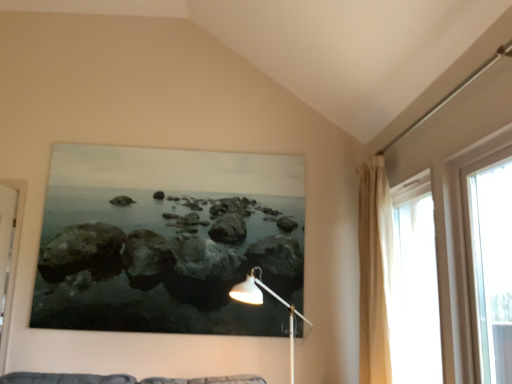
Measure the distance between point (x=380, y=247) and camera.

The distance of point (x=380, y=247) from camera is 2.73 meters.

What do you see at coordinates (262, 303) in the screenshot? The height and width of the screenshot is (384, 512). I see `white metal floor lamp at lower center` at bounding box center [262, 303].

This screenshot has height=384, width=512. What are the coordinates of `beige fabric curtain at right` in the screenshot? It's located at (375, 272).

From a real-world perspective, which is physically below, transparent glass window at right, which is the first window in front-to-back order, or translucent fabric curtain at right, the 2th window when ordered from front to back?

In real-world perspective, translucent fabric curtain at right, the 2th window when ordered from front to back, is lower.

Which point is more distant from viewer, (487, 156) or (407, 226)?

Positioned behind is point (407, 226).

Is transparent glass window at right, acting as the second window starting from the back, shorter than translucent fabric curtain at right, the 2th window when ordered from front to back?

Yes.

Do you think transparent glass window at right, which is the first window in front-to-back order, is within translucent fabric curtain at right, the 2th window when ordered from front to back, or outside of it?

transparent glass window at right, which is the first window in front-to-back order, exists outside the volume of translucent fabric curtain at right, the 2th window when ordered from front to back.

Is translucent fabric curtain at right, the first window in the back-to-front sequence, placed right next to transparent glass window at right, which is the first window in front-to-back order?

No, translucent fabric curtain at right, the first window in the back-to-front sequence, is not making contact with transparent glass window at right, which is the first window in front-to-back order.

Is transparent glass window at right, which is the first window in front-to-back order, a part of translucent fabric curtain at right, the 2th window when ordered from front to back?

No, transparent glass window at right, which is the first window in front-to-back order, is not a part of translucent fabric curtain at right, the 2th window when ordered from front to back.

In order to click on window lying on the right of translucent fabric curtain at right, the 2th window when ordered from front to back in this screenshot , I will do `click(458, 252)`.

Which point is more forward, (x=416, y=272) or (x=442, y=265)?

The point (x=442, y=265) is closer to the camera.

Is beige fabric curtain at right at the right side of translucent fabric curtain at right, the first window in the back-to-front sequence?

In fact, beige fabric curtain at right is to the left of translucent fabric curtain at right, the first window in the back-to-front sequence.

Does beige fabric curtain at right turn towards translucent fabric curtain at right, the 2th window when ordered from front to back?

No, beige fabric curtain at right is not oriented towards translucent fabric curtain at right, the 2th window when ordered from front to back.

From their relative heights in the image, would you say beige fabric curtain at right is taller or shorter than translucent fabric curtain at right, the 2th window when ordered from front to back?

In the image, beige fabric curtain at right appears to be taller than translucent fabric curtain at right, the 2th window when ordered from front to back.

Considering the relative sizes of beige fabric curtain at right and translucent fabric curtain at right, the 2th window when ordered from front to back, in the image provided, is beige fabric curtain at right thinner than translucent fabric curtain at right, the 2th window when ordered from front to back,?

In fact, beige fabric curtain at right might be wider than translucent fabric curtain at right, the 2th window when ordered from front to back.

Would you say translucent fabric curtain at right, the 2th window when ordered from front to back, is part of white metal floor lamp at lower center's contents?

No, translucent fabric curtain at right, the 2th window when ordered from front to back, is not surrounded by white metal floor lamp at lower center.

From a real-world perspective, is white metal floor lamp at lower center positioned under translucent fabric curtain at right, the first window in the back-to-front sequence, based on gravity?

Yes, from a real-world perspective, white metal floor lamp at lower center is beneath translucent fabric curtain at right, the first window in the back-to-front sequence.

Does point (291, 374) lie behind point (413, 381)?

Yes.

Is beige fabric curtain at right turned away from transparent glass window at right, which is the first window in front-to-back order?

No.

Considering the sizes of objects beige fabric curtain at right and transparent glass window at right, acting as the second window starting from the back, in the image provided, who is taller, beige fabric curtain at right or transparent glass window at right, acting as the second window starting from the back,?

Standing taller between the two is beige fabric curtain at right.

Considering the points (481, 144) and (292, 367), which point is in front, point (481, 144) or point (292, 367)?

Positioned in front is point (481, 144).

Considering the sizes of objects transparent glass window at right, which is the first window in front-to-back order, and white metal floor lamp at lower center in the image provided, who is wider, transparent glass window at right, which is the first window in front-to-back order, or white metal floor lamp at lower center?

white metal floor lamp at lower center is wider.

Which object is closer to the camera, transparent glass window at right, which is the first window in front-to-back order, or white metal floor lamp at lower center?

transparent glass window at right, which is the first window in front-to-back order, is closer to the camera.

Is white metal floor lamp at lower center inside or outside of beige fabric curtain at right?

white metal floor lamp at lower center is located beyond the bounds of beige fabric curtain at right.

How many degrees apart are the facing directions of white metal floor lamp at lower center and beige fabric curtain at right?

They differ by 42.6 degrees in their facing directions.

Is white metal floor lamp at lower center with beige fabric curtain at right?

There is a gap between white metal floor lamp at lower center and beige fabric curtain at right.

Does point (286, 303) come behind point (381, 324)?

Yes, point (286, 303) is behind point (381, 324).

The image size is (512, 384). I want to click on window that is under the transparent glass window at right, which is the first window in front-to-back order (from a real-world perspective), so click(x=416, y=283).

The width and height of the screenshot is (512, 384). I want to click on window below the transparent glass window at right, which is the first window in front-to-back order (from the image's perspective), so click(x=416, y=283).

Considering their positions, is transparent glass window at right, acting as the second window starting from the back, positioned closer to white metal floor lamp at lower center than beige fabric curtain at right?

beige fabric curtain at right.

When comparing their distances from beige fabric curtain at right, does transparent glass window at right, acting as the second window starting from the back, or white metal floor lamp at lower center seem closer?

transparent glass window at right, acting as the second window starting from the back, lies closer to beige fabric curtain at right than the other object.

When comparing their distances from white metal floor lamp at lower center, does beige fabric curtain at right or transparent glass window at right, acting as the second window starting from the back, seem further?

transparent glass window at right, acting as the second window starting from the back, is positioned further to the anchor white metal floor lamp at lower center.

When comparing their distances from translucent fabric curtain at right, the first window in the back-to-front sequence, does transparent glass window at right, acting as the second window starting from the back, or beige fabric curtain at right seem closer?

Based on the image, beige fabric curtain at right appears to be nearer to translucent fabric curtain at right, the first window in the back-to-front sequence.

Considering their positions, is translucent fabric curtain at right, the 2th window when ordered from front to back, positioned further to transparent glass window at right, acting as the second window starting from the back, than white metal floor lamp at lower center?

Among the two, white metal floor lamp at lower center is located further to transparent glass window at right, acting as the second window starting from the back.

Based on their spatial positions, is white metal floor lamp at lower center or transparent glass window at right, which is the first window in front-to-back order, closer to translucent fabric curtain at right, the first window in the back-to-front sequence?

transparent glass window at right, which is the first window in front-to-back order.

From the image, which object appears to be nearer to translucent fabric curtain at right, the 2th window when ordered from front to back, white metal floor lamp at lower center or beige fabric curtain at right?

Based on the image, beige fabric curtain at right appears to be nearer to translucent fabric curtain at right, the 2th window when ordered from front to back.

Which object lies nearer to the anchor point beige fabric curtain at right, translucent fabric curtain at right, the 2th window when ordered from front to back, or transparent glass window at right, which is the first window in front-to-back order?

translucent fabric curtain at right, the 2th window when ordered from front to back, is positioned closer to the anchor beige fabric curtain at right.

The image size is (512, 384). I want to click on window between white metal floor lamp at lower center and transparent glass window at right, acting as the second window starting from the back, in the horizontal direction, so click(416, 283).

The image size is (512, 384). Find the location of `table lamp positioned between transparent glass window at right, which is the first window in front-to-back order, and beige fabric curtain at right from near to far`. table lamp positioned between transparent glass window at right, which is the first window in front-to-back order, and beige fabric curtain at right from near to far is located at coordinates (262, 303).

Where is `curtain between white metal floor lamp at lower center and translucent fabric curtain at right, the first window in the back-to-front sequence, from left to right`? The image size is (512, 384). curtain between white metal floor lamp at lower center and translucent fabric curtain at right, the first window in the back-to-front sequence, from left to right is located at coordinates (375, 272).

At what (x,y) coordinates should I click in order to perform the action: click on window between transparent glass window at right, acting as the second window starting from the back, and beige fabric curtain at right, along the z-axis. Please return your answer as a coordinate pair (x, y). The height and width of the screenshot is (384, 512). Looking at the image, I should click on (416, 283).